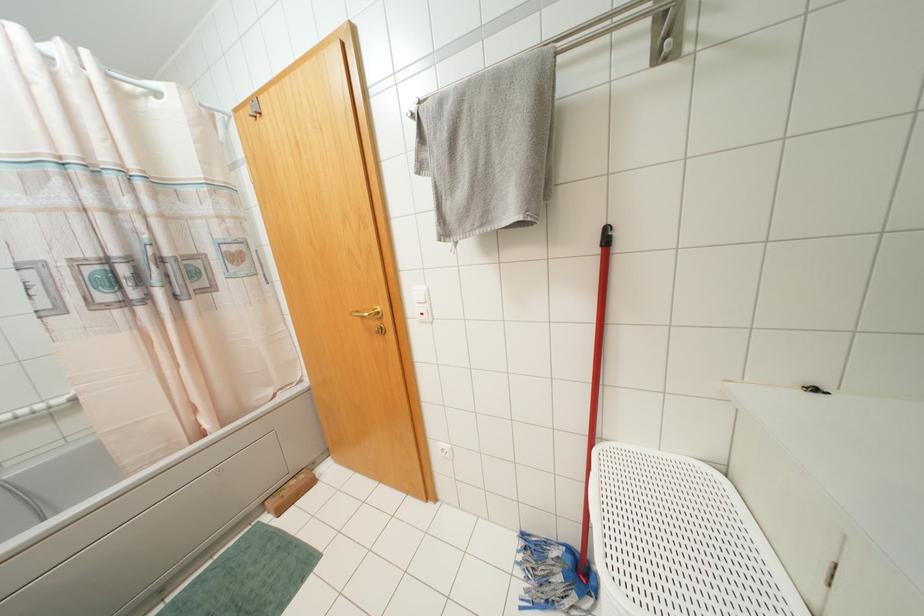
Describe the element at coordinates (420, 296) in the screenshot. The image size is (924, 616). I see `the white light switch` at that location.